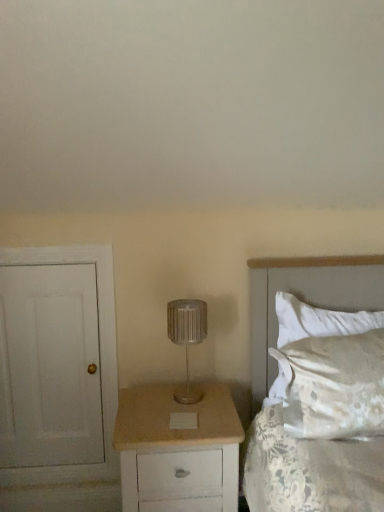
Question: In terms of height, does white painted wood door at left look taller or shorter compared to white satin pillow at right?

Choices:
 (A) tall
 (B) short

Answer: (A)

Question: Is point tap(66, 394) positioned closer to the camera than point tap(332, 404)?

Choices:
 (A) closer
 (B) farther

Answer: (B)

Question: Considering the real-world distances, which object is farthest from the silver metallic lamp at center?

Choices:
 (A) white satin bed at right
 (B) white painted wood door at left
 (C) beige wood chest of drawers at center
 (D) white satin pillow at right

Answer: (B)

Question: Which of these objects is positioned farthest from the white satin pillow at right?

Choices:
 (A) white satin bed at right
 (B) white painted wood door at left
 (C) silver metallic lamp at center
 (D) beige wood chest of drawers at center

Answer: (B)